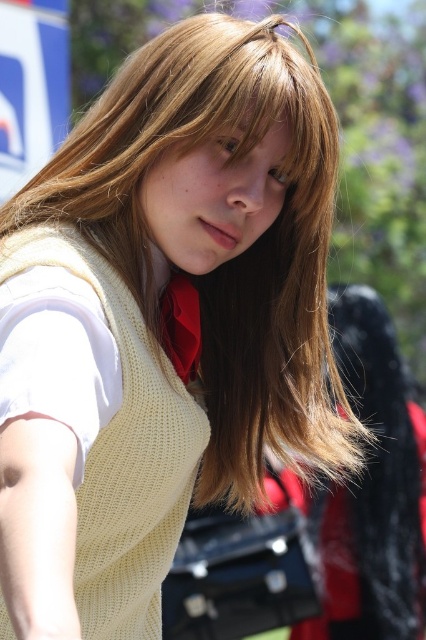
Is blonde hair at center positioned before light yellow knitted sweater at center?

No.

Measure the distance between blonde hair at center and light yellow knitted sweater at center.

blonde hair at center is 25.53 centimeters away from light yellow knitted sweater at center.

Who is more forward, (68, 193) or (135, 492)?

Point (135, 492)

You are a GUI agent. You are given a task and a screenshot of the screen. Output one action in this format:
    pyautogui.click(x=<x>, y=<y>)
    Task: Click on the blonde hair at center
    The height and width of the screenshot is (640, 426).
    Given the screenshot: What is the action you would take?
    pyautogui.click(x=227, y=260)

In the scene shown: Who is positioned more to the left, blonde hair at center or matte red tie at center?

From the viewer's perspective, matte red tie at center appears more on the left side.

This screenshot has width=426, height=640. What do you see at coordinates (227, 260) in the screenshot? I see `blonde hair at center` at bounding box center [227, 260].

Identify the location of blonde hair at center. The image size is (426, 640). (227, 260).

Is light yellow knitted sweater at center to the left of matte red tie at center from the viewer's perspective?

Yes, light yellow knitted sweater at center is to the left of matte red tie at center.

This screenshot has height=640, width=426. What are the coordinates of `light yellow knitted sweater at center` in the screenshot? It's located at (123, 452).